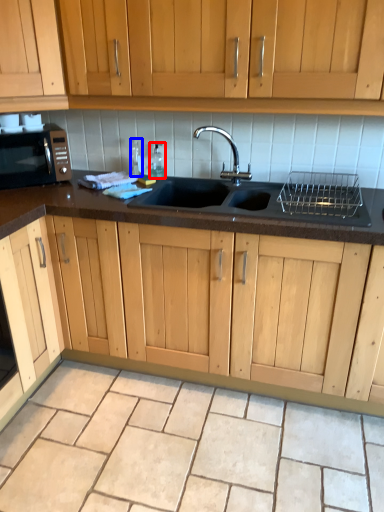
Question: Which object is further to the camera taking this photo, bottle (highlighted by a red box) or bottle (highlighted by a blue box)?

Choices:
 (A) bottle
 (B) bottle

Answer: (A)